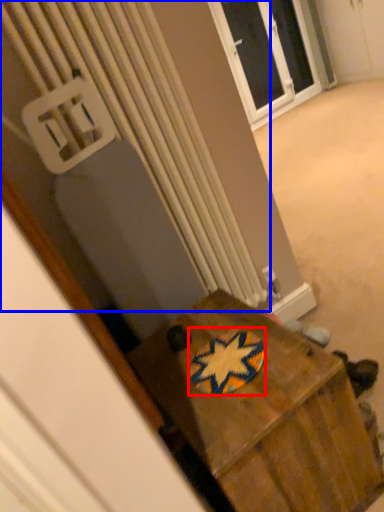
Question: Which object is closer to the camera taking this photo, design (highlighted by a red box) or radiator (highlighted by a blue box)?

Choices:
 (A) design
 (B) radiator

Answer: (A)